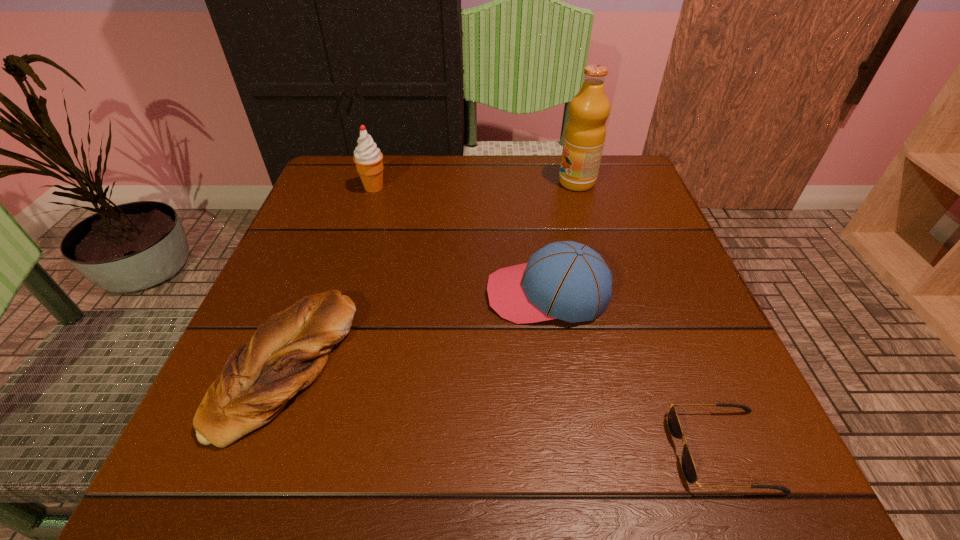
Where is `icecream at the left edge`? icecream at the left edge is located at coordinates (368, 159).

Where is `bread that is at the left edge`? The image size is (960, 540). bread that is at the left edge is located at coordinates (289, 349).

Locate an element on the screen. Image resolution: width=960 pixels, height=540 pixels. fruit juice situated at the right edge is located at coordinates (585, 132).

Identify the location of baseball cap that is at the right edge. (566, 280).

Locate an element on the screen. The image size is (960, 540). sunglasses located in the right edge section of the desktop is located at coordinates (688, 467).

Where is `object that is positioned at the far left corner`? object that is positioned at the far left corner is located at coordinates (368, 159).

Locate an element on the screen. The image size is (960, 540). object that is positioned at the near left corner is located at coordinates (289, 349).

The image size is (960, 540). I want to click on object that is at the far right corner, so click(x=585, y=132).

Locate an element on the screen. This screenshot has width=960, height=540. object located at the near right corner is located at coordinates (688, 467).

Where is `free spot at the far edge of the desktop`? The height and width of the screenshot is (540, 960). free spot at the far edge of the desktop is located at coordinates (383, 198).